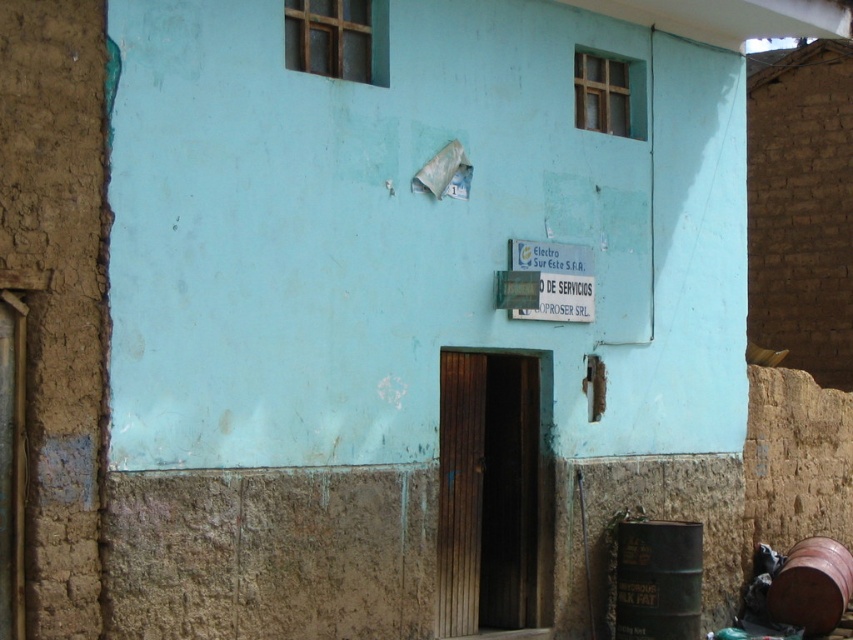
Is point (618, 627) positioned after point (788, 576)?

No, it is in front of (788, 576).

Does point (677, 564) lie behind point (850, 573)?

No, it is in front of (850, 573).

You are a GUI agent. You are given a task and a screenshot of the screen. Output one action in this format:
    pyautogui.click(x=<x>, y=<y>)
    Task: Click on the green metallic barrel at lower right
    The height and width of the screenshot is (640, 853).
    Given the screenshot: What is the action you would take?
    pyautogui.click(x=659, y=579)